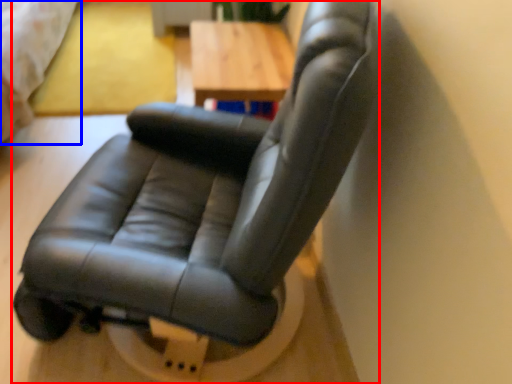
Question: Among these objects, which one is nearest to the camera, chair (highlighted by a red box) or bed (highlighted by a blue box)?

Choices:
 (A) chair
 (B) bed

Answer: (A)